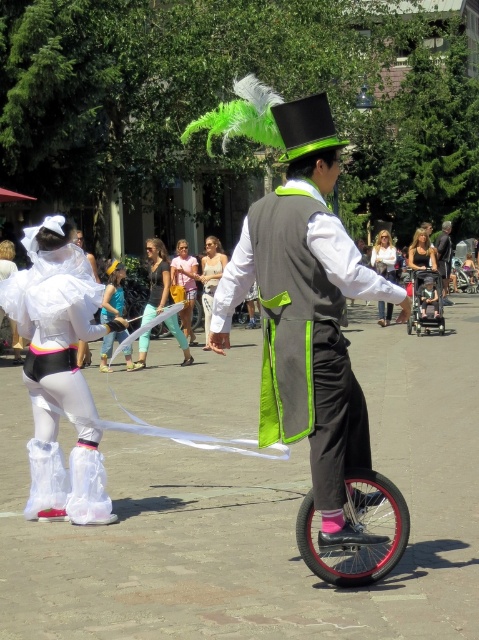
Question: Does white satin skirt at lower left appear on the right side of shiny metallic monocycle at center?

Choices:
 (A) no
 (B) yes

Answer: (A)

Question: Which object appears closest to the camera in this image?

Choices:
 (A) white satin skirt at lower left
 (B) shiny metallic monocycle at center

Answer: (A)

Question: Which point appears closest to the camera in this image?

Choices:
 (A) (383, 280)
 (B) (38, 344)
 (C) (445, 296)

Answer: (A)

Question: From the image, what is the correct spatial relationship of white satin skirt at lower left in relation to shiny silver helmet at center?

Choices:
 (A) below
 (B) above

Answer: (A)

Question: Which point is closer to the camera?

Choices:
 (A) shiny metallic monocycle at center
 (B) matte gray vest at center
 (C) white satin skirt at lower left
 (D) shiny silver helmet at center

Answer: (B)

Question: Is matte gray vest at center bigger than shiny metallic monocycle at center?

Choices:
 (A) yes
 (B) no

Answer: (B)